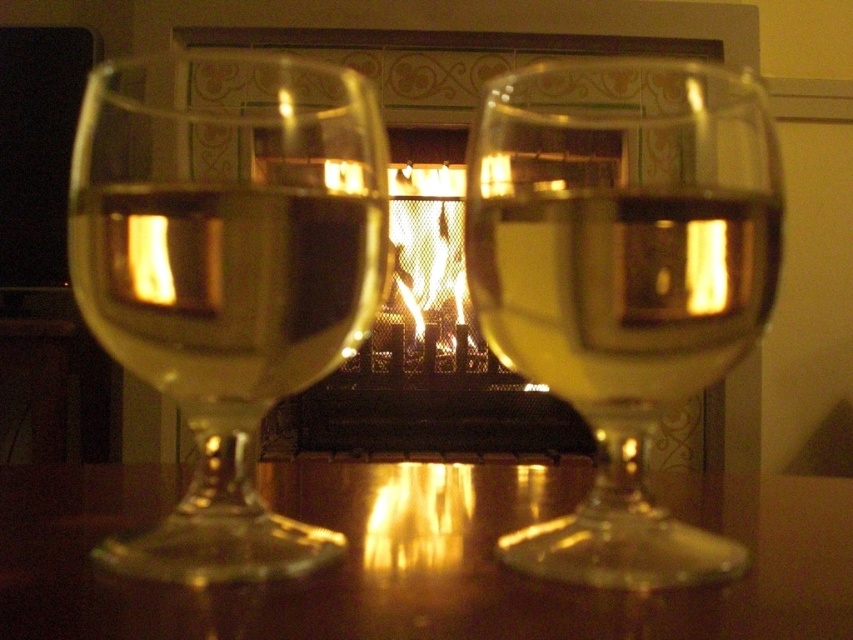
Which is in front, point (708, 444) or point (457, 243)?

Point (708, 444) is more forward.

Is point (541, 451) positioned before point (346, 442)?

No, (541, 451) is behind (346, 442).

Is point (427, 100) less distant than point (392, 209)?

Yes, point (427, 100) is in front of point (392, 209).

Identify the location of matte glass fireplace at center. (451, 209).

Describe the element at coordinates (225, 284) in the screenshot. The height and width of the screenshot is (640, 853). I see `translucent glass at left` at that location.

Is translucent glass at left below translucent glass at center?

No, translucent glass at left is not below translucent glass at center.

Is point (257, 355) positioned before point (776, 218)?

Yes, it is in front of point (776, 218).

Locate an element on the screen. translucent glass at left is located at coordinates (225, 284).

Is point (761, 624) farther from camera compared to point (189, 317)?

No, it is in front of (189, 317).

Who is higher up, glossy wood table at center or translucent glass at left?

translucent glass at left is higher up.

Identify the location of glossy wood table at center. tap(421, 556).

You are a GUI agent. You are given a task and a screenshot of the screen. Output one action in this format:
    pyautogui.click(x=<x>, y=<y>)
    Task: Click on the glossy wood table at center
    This screenshot has width=853, height=640.
    Given the screenshot: What is the action you would take?
    pyautogui.click(x=421, y=556)